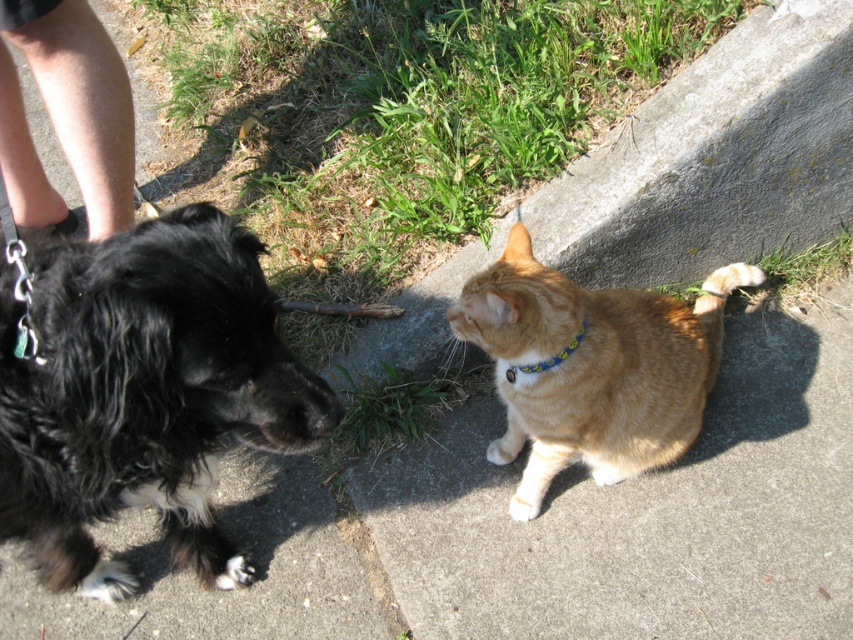
Between black fluffy dog at left and blue fabric neckband at center, which one has less height?

With less height is blue fabric neckband at center.

Describe the element at coordinates (143, 394) in the screenshot. I see `black fluffy dog at left` at that location.

Describe the element at coordinates (143, 394) in the screenshot. I see `black fluffy dog at left` at that location.

Locate an element on the screen. The width and height of the screenshot is (853, 640). black fluffy dog at left is located at coordinates (143, 394).

Is orange fur cat at center positioned behind blue fabric neckband at center?

No.

Does point (695, 349) lie in front of point (525, 371)?

No, it is not.

In the scene shown: Who is more distant from viewer, (x=683, y=316) or (x=531, y=364)?

The point (x=683, y=316) is more distant.

Where is `orange fur cat at center`? This screenshot has width=853, height=640. orange fur cat at center is located at coordinates (590, 365).

Is black fluffy dog at left behind orange fur cat at center?

No, it is in front of orange fur cat at center.

Between point (149, 408) and point (511, 385), which one is positioned in front?

Point (149, 408)

Is point (339, 419) more distant than point (561, 275)?

That is False.

Where is `black fluffy dog at left`? Image resolution: width=853 pixels, height=640 pixels. black fluffy dog at left is located at coordinates (143, 394).